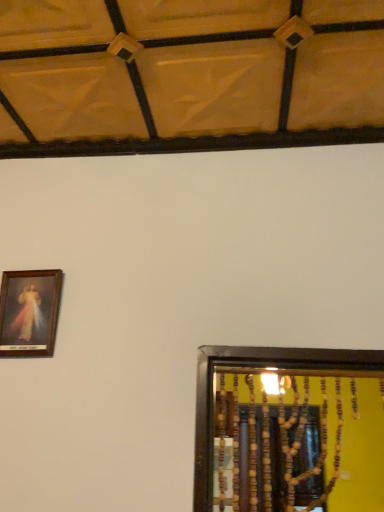
Describe the element at coordinates (29, 312) in the screenshot. I see `wooden-framed painting at upper left` at that location.

The height and width of the screenshot is (512, 384). In order to click on wooden-framed painting at upper left in this screenshot , I will do `click(29, 312)`.

The width and height of the screenshot is (384, 512). In order to click on wooden-framed painting at upper left in this screenshot , I will do `click(29, 312)`.